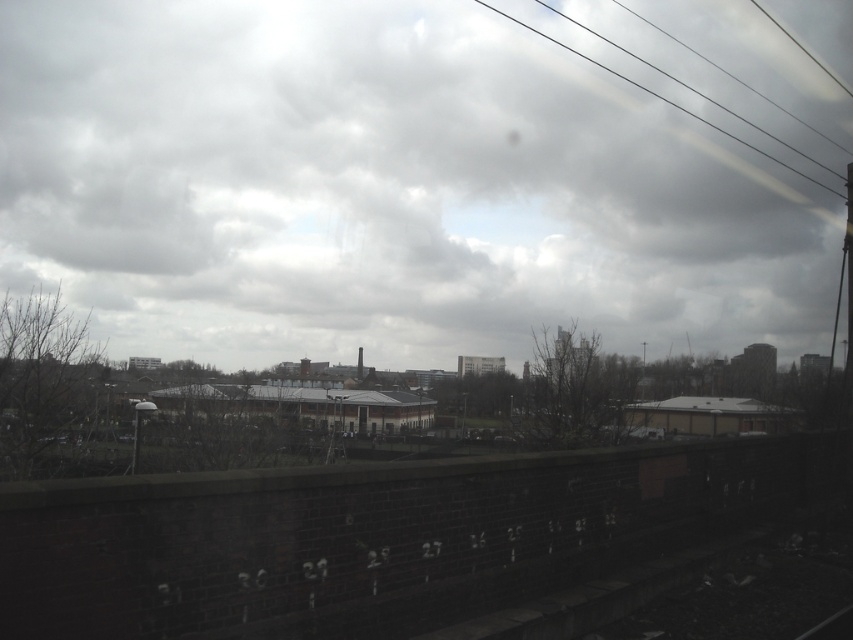
Question: Can you confirm if cloudy sky at upper center is positioned above smooth wire at upper right?

Choices:
 (A) no
 (B) yes

Answer: (A)

Question: Which of the following is the farthest from the observer?

Choices:
 (A) smooth wire at upper right
 (B) cloudy sky at upper center

Answer: (A)

Question: Considering the relative positions of cloudy sky at upper center and smooth wire at upper right in the image provided, where is cloudy sky at upper center located with respect to smooth wire at upper right?

Choices:
 (A) right
 (B) left

Answer: (B)

Question: From the image, what is the correct spatial relationship of cloudy sky at upper center in relation to smooth wire at upper right?

Choices:
 (A) left
 (B) right

Answer: (A)

Question: Which object appears farthest from the camera in this image?

Choices:
 (A) smooth wire at upper right
 (B) cloudy sky at upper center

Answer: (A)

Question: Which object appears farthest from the camera in this image?

Choices:
 (A) smooth wire at upper right
 (B) cloudy sky at upper center

Answer: (A)